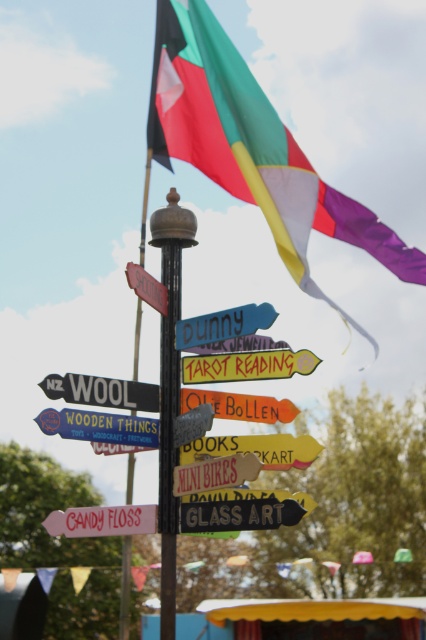
Is pink matte candy floss at lower left taller than orange matte sign at center?

→ Yes.

Describe the element at coordinates (103, 520) in the screenshot. This screenshot has height=640, width=426. I see `pink matte candy floss at lower left` at that location.

You are a GUI agent. You are given a task and a screenshot of the screen. Output one action in this format:
    pyautogui.click(x=<x>, y=<y>)
    Task: Click on the pink matte candy floss at lower left
    The image size is (426, 640).
    Given the screenshot: What is the action you would take?
    pyautogui.click(x=103, y=520)

Does pink matte candy floss at lower left have a larger size compared to wooden signpost at center?

Yes.

Between pink matte candy floss at lower left and wooden signpost at center, which one appears on the right side from the viewer's perspective?

From the viewer's perspective, wooden signpost at center appears more on the right side.

Between point (57, 516) and point (250, 342), which one is positioned behind?

Positioned behind is point (250, 342).

In order to click on pink matte candy floss at lower left in this screenshot , I will do `click(103, 520)`.

Which of these two, wooden sign at center or orange matte sign at center, stands taller?

With more height is wooden sign at center.

This screenshot has width=426, height=640. What do you see at coordinates (100, 426) in the screenshot?
I see `wooden sign at center` at bounding box center [100, 426].

You are a GUI agent. You are given a task and a screenshot of the screen. Output one action in this format:
    pyautogui.click(x=<x>, y=<y>)
    Task: Click on the wooden sign at center
    
    Given the screenshot: What is the action you would take?
    pyautogui.click(x=100, y=426)